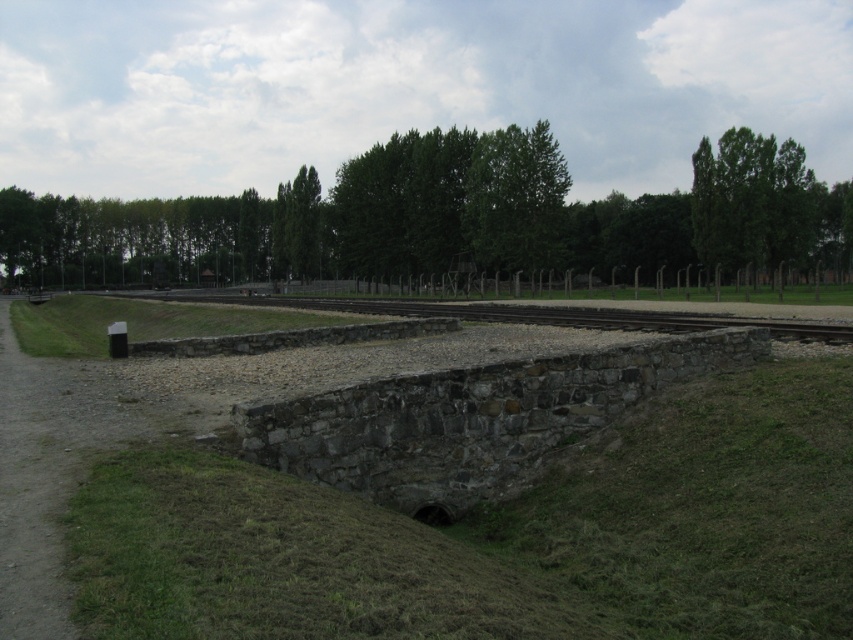
You are standing at the point marked as point [242,508] in the image. What object is located exactly at that point?

The gray stone bridge at center is located exactly at point [242,508].

You are a visitor at this historical site and want to take a photo that includes both the green leafy trees at upper center and the green leafy tree at upper right. Which tree should you position closer to the camera to ensure both are in frame?

To include both the green leafy trees at upper center and the green leafy tree at upper right in the photo, position the green leafy trees at upper center closer to the camera since it is larger and will appear more prominent in the frame.

You are standing at the entrance of the drainage system near the stone wall. You see two points marked on the ground, point (788, 248) and point (184, 298). Which point is closer to you?

Point (788, 248) is in front of point (184, 298), so it is closer to you.